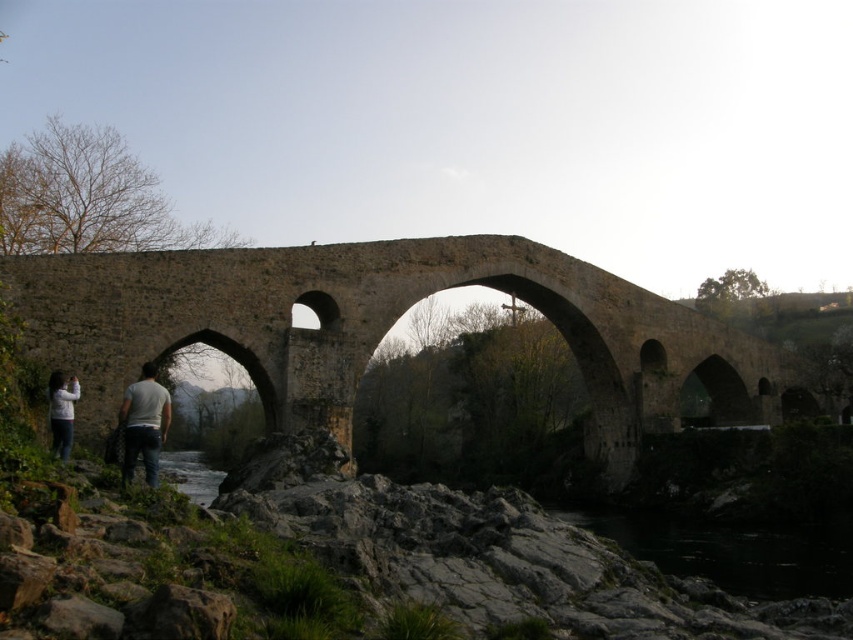
Is stone arch bridge at center thinner than clear water at lower center?

No.

Image resolution: width=853 pixels, height=640 pixels. I want to click on stone arch bridge at center, so (386, 328).

Is stone arch bridge at center below white cotton shirt at lower left?

Incorrect, stone arch bridge at center is not positioned below white cotton shirt at lower left.

Which is in front, point (242, 314) or point (56, 385)?

Point (56, 385)

Measure the distance between point [45,272] and camera.

Point [45,272] and camera are 59.60 meters apart from each other.

Where is `stone arch bridge at center`? This screenshot has height=640, width=853. stone arch bridge at center is located at coordinates (386, 328).

Based on the photo, is clear water at lower center below white cotton shirt at lower left?

Correct, clear water at lower center is located below white cotton shirt at lower left.

Is clear water at lower center bigger than white cotton shirt at lower left?

Yes, clear water at lower center is bigger than white cotton shirt at lower left.

Between point (201, 500) and point (61, 378), which one is positioned in front?

Positioned in front is point (61, 378).

Where is `clear water at lower center`? The image size is (853, 640). clear water at lower center is located at coordinates (190, 476).